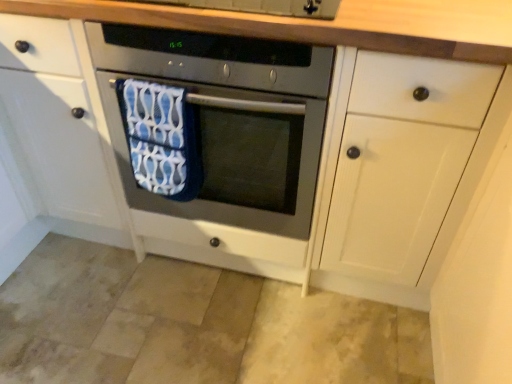
Question: Is satin silver oven at center in front of or behind blue fabric beach towel at center in the image?

Choices:
 (A) behind
 (B) front

Answer: (B)

Question: Looking at the image, does satin silver oven at center seem bigger or smaller compared to blue fabric beach towel at center?

Choices:
 (A) small
 (B) big

Answer: (B)

Question: Is satin silver oven at center wider or thinner than blue fabric beach towel at center?

Choices:
 (A) wide
 (B) thin

Answer: (A)

Question: From their relative heights in the image, would you say blue fabric beach towel at center is taller or shorter than satin silver oven at center?

Choices:
 (A) short
 (B) tall

Answer: (A)

Question: Is blue fabric beach towel at center bigger or smaller than satin silver oven at center?

Choices:
 (A) big
 (B) small

Answer: (B)

Question: Considering the positions of point pyautogui.click(x=136, y=152) and point pyautogui.click(x=123, y=43), is point pyautogui.click(x=136, y=152) closer or farther from the camera than point pyautogui.click(x=123, y=43)?

Choices:
 (A) farther
 (B) closer

Answer: (A)

Question: Considering the positions of blue fabric beach towel at center and satin silver oven at center in the image, is blue fabric beach towel at center wider or thinner than satin silver oven at center?

Choices:
 (A) wide
 (B) thin

Answer: (B)